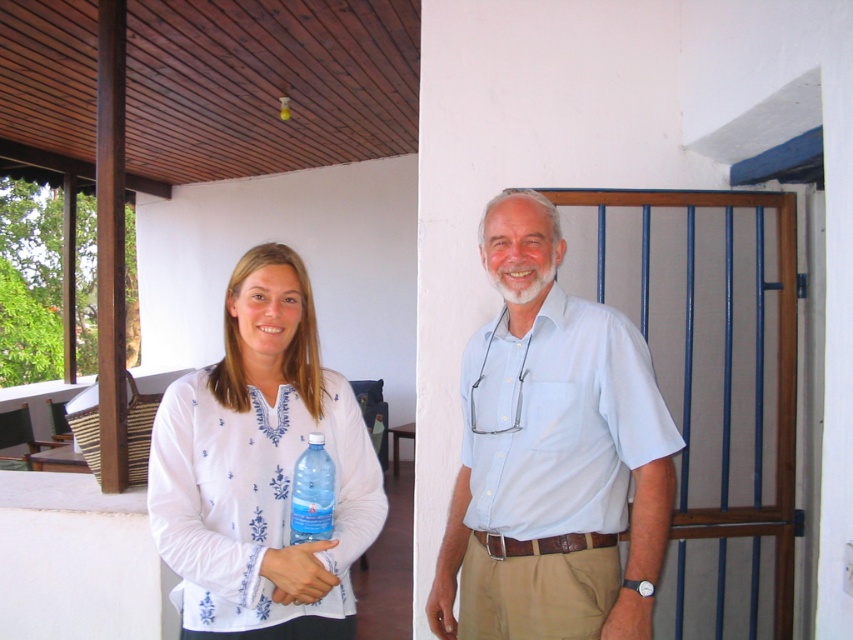
Question: Is light blue cotton shirt at center to the left of white embroidered shirt at left from the viewer's perspective?

Choices:
 (A) yes
 (B) no

Answer: (B)

Question: Does light blue cotton shirt at center come behind white embroidered shirt at left?

Choices:
 (A) no
 (B) yes

Answer: (B)

Question: Which object appears closest to the camera in this image?

Choices:
 (A) light blue cotton shirt at center
 (B) white embroidered shirt at left
 (C) transparent plastic bottle at center

Answer: (B)

Question: Which point is closer to the camera?

Choices:
 (A) light blue cotton shirt at center
 (B) transparent plastic bottle at center

Answer: (B)

Question: Estimate the real-world distances between objects in this image. Which object is closer to the transparent plastic bottle at center?

Choices:
 (A) white embroidered shirt at left
 (B) light blue cotton shirt at center

Answer: (A)

Question: Is white embroidered shirt at left above transparent plastic bottle at center?

Choices:
 (A) no
 (B) yes

Answer: (B)